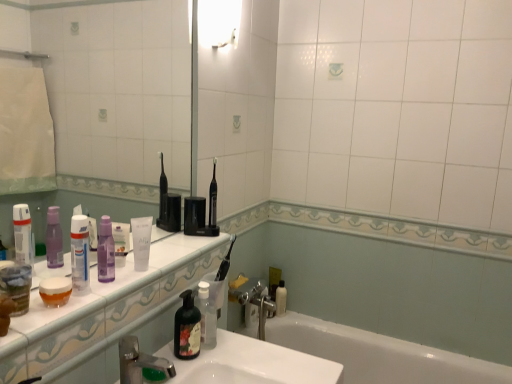
At what (x,y) coordinates should I click in order to perform the action: click on vacant region to the right of silver metallic faucet at lower center. Please return your answer as a coordinate pair (x, y). The height and width of the screenshot is (384, 512). Looking at the image, I should click on (224, 360).